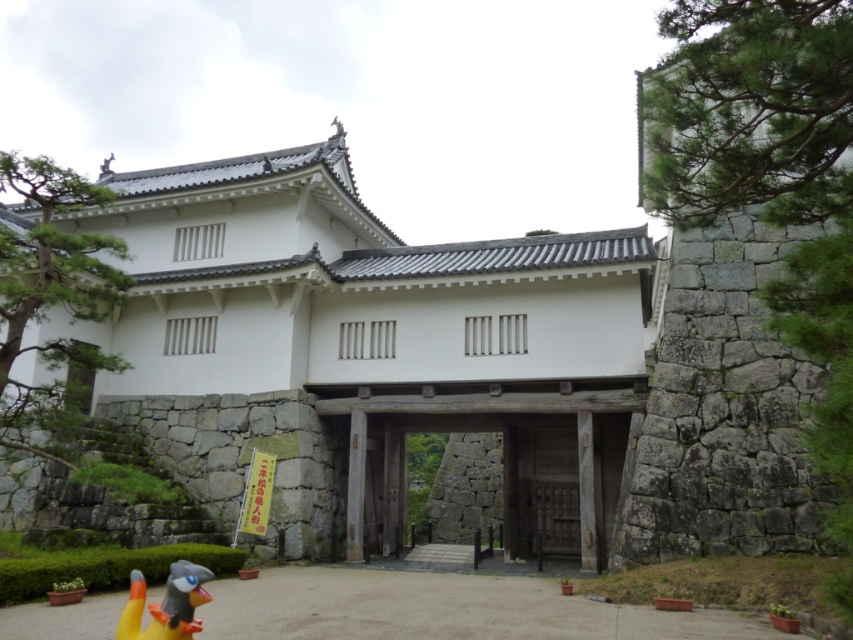
Question: Which object is closer to the camera taking this photo?

Choices:
 (A) green textured stone wall at right
 (B) green leafy tree at center

Answer: (A)

Question: Which point is farther to the camera?

Choices:
 (A) green stone tree at upper left
 (B) green textured stone wall at right

Answer: (A)

Question: Is the position of green textured stone wall at right more distant than that of rubber yellow duck at lower left?

Choices:
 (A) yes
 (B) no

Answer: (A)

Question: Is the position of rubber yellow duck at lower left more distant than that of green leafy tree at center?

Choices:
 (A) yes
 (B) no

Answer: (B)

Question: Does white stone gate at center appear on the left side of green stone tree at upper left?

Choices:
 (A) no
 (B) yes

Answer: (A)

Question: Which of the following is the closest to the observer?

Choices:
 (A) (815, 204)
 (B) (427, 461)

Answer: (A)